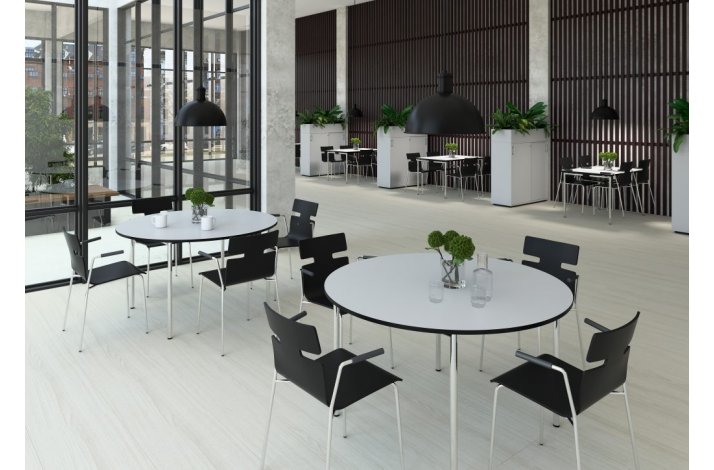
The height and width of the screenshot is (470, 714). Identify the location of small plants in center of tables. (453, 244), (196, 199), (353, 140), (453, 145), (608, 156).